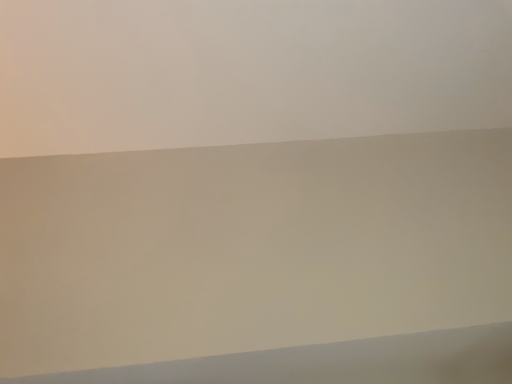
Where is `matte sand at upper center`? matte sand at upper center is located at coordinates (246, 71).

This screenshot has height=384, width=512. What do you see at coordinates (246, 71) in the screenshot? I see `matte sand at upper center` at bounding box center [246, 71].

At what (x,y) coordinates should I click in order to perform the action: click on matte sand at upper center. Please return your answer as a coordinate pair (x, y). This screenshot has width=512, height=384. Looking at the image, I should click on (246, 71).